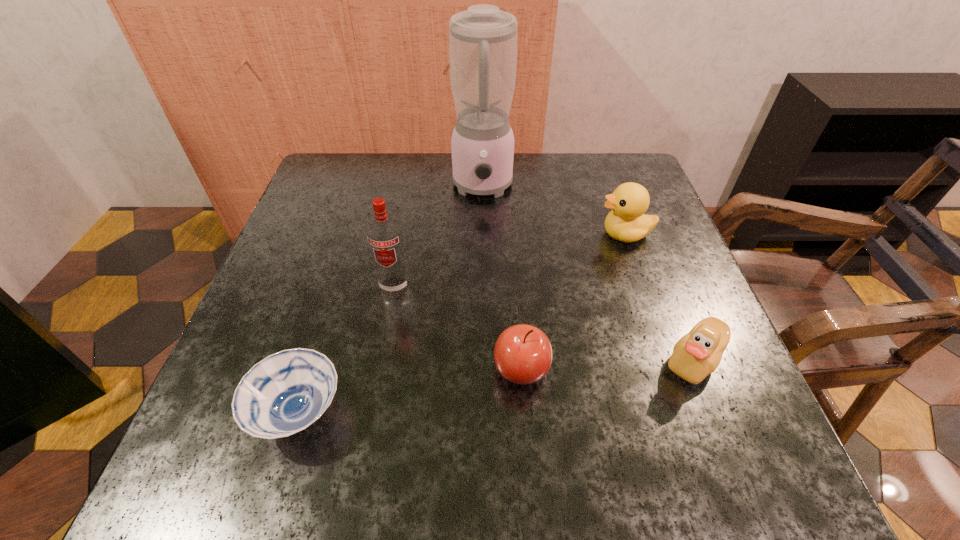
At what (x,y) coordinates should I click in order to perform the action: click on object that is at the far edge. Please return your answer as a coordinate pair (x, y). The height and width of the screenshot is (540, 960). Looking at the image, I should click on (483, 39).

Locate an element on the screen. The height and width of the screenshot is (540, 960). object that is at the near edge is located at coordinates (x=285, y=393).

You are a GUI agent. You are given a task and a screenshot of the screen. Output one action in this format:
    pyautogui.click(x=<x>, y=<y>)
    Task: Click on the object present at the left edge
    Image resolution: width=960 pixels, height=540 pixels.
    Given the screenshot: What is the action you would take?
    pyautogui.click(x=285, y=393)

Find the location of a particular element. The height and width of the screenshot is (540, 960). object located at the near left corner is located at coordinates (285, 393).

This screenshot has height=540, width=960. I want to click on vacant space at the far edge of the desktop, so click(x=559, y=171).

Locate an element on the screen. The height and width of the screenshot is (540, 960). free region at the near edge is located at coordinates tap(295, 479).

Identify the location of vacant space at the left edge of the desktop. This screenshot has height=540, width=960. (307, 233).

In the image, there is a desktop. In order to click on blank space at the right edge in this screenshot , I will do `click(640, 287)`.

The image size is (960, 540). I want to click on free spot at the far left corner of the desktop, so click(x=371, y=171).

Where is `vacant area at the far right corner`? vacant area at the far right corner is located at coordinates coord(655,201).